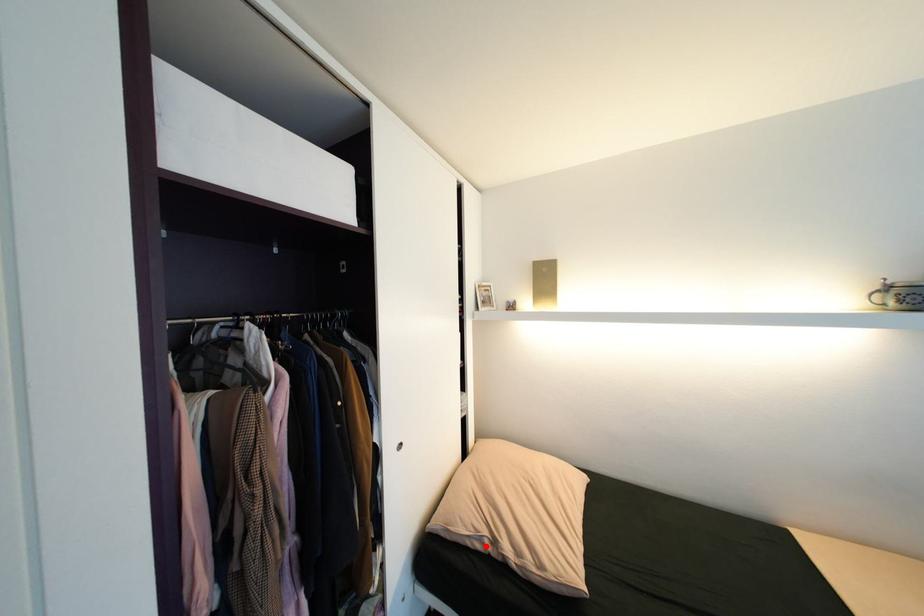
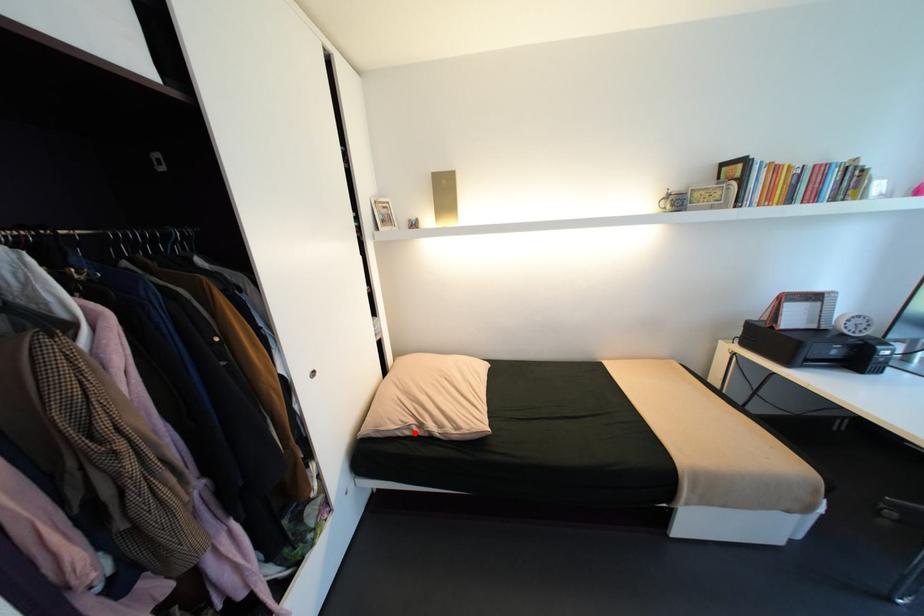
I am providing you with two images of the same scene from different viewpoints. A red point is marked on the first image and another point is marked on the second image. Is the red point in image1 aligned with the point shown in image2?

Yes